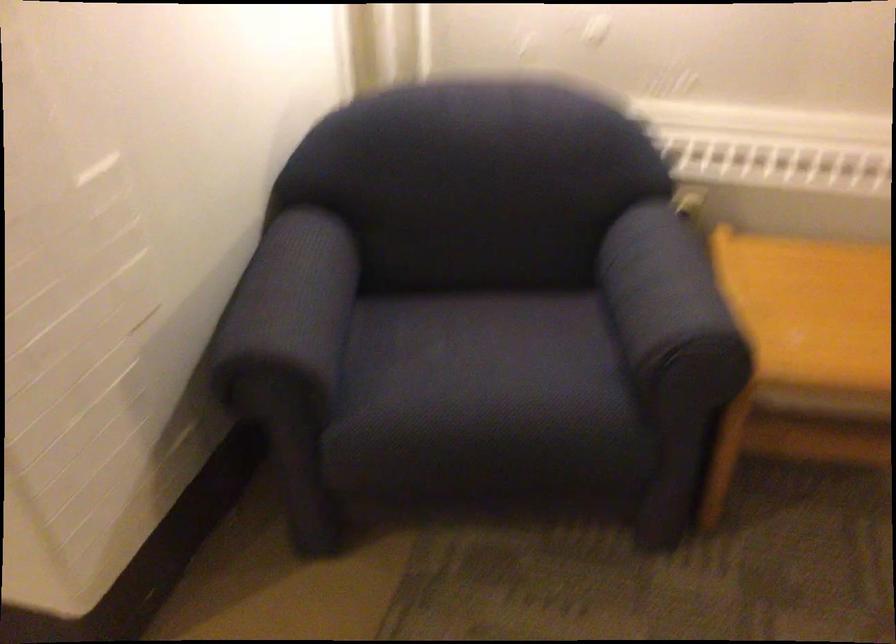
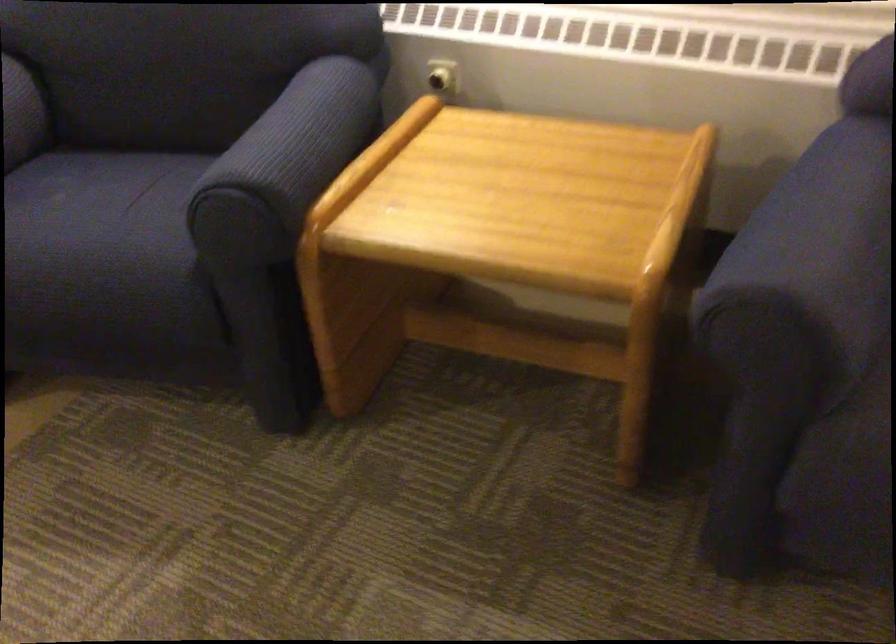
Where in the second image is the point corresponding to (704,283) from the first image?

(295, 144)